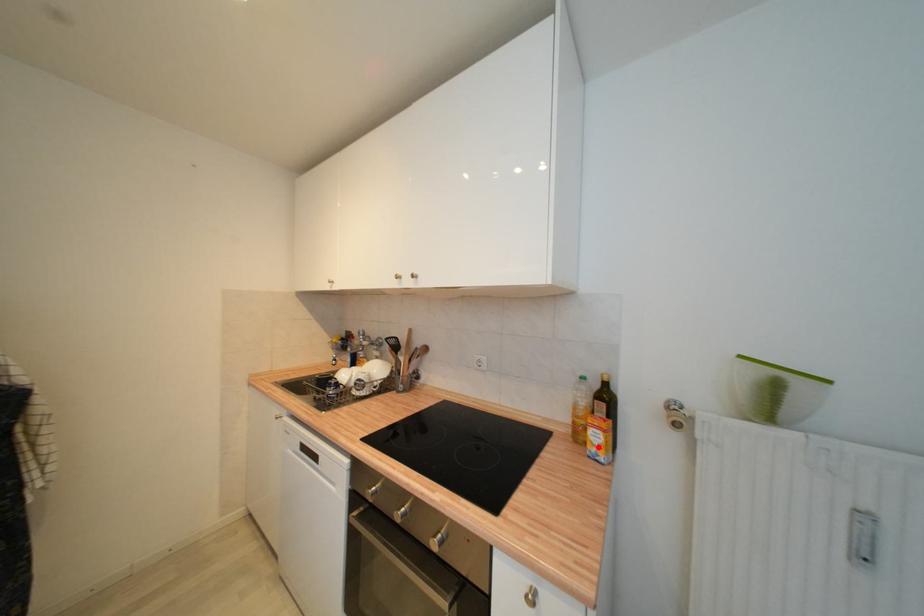
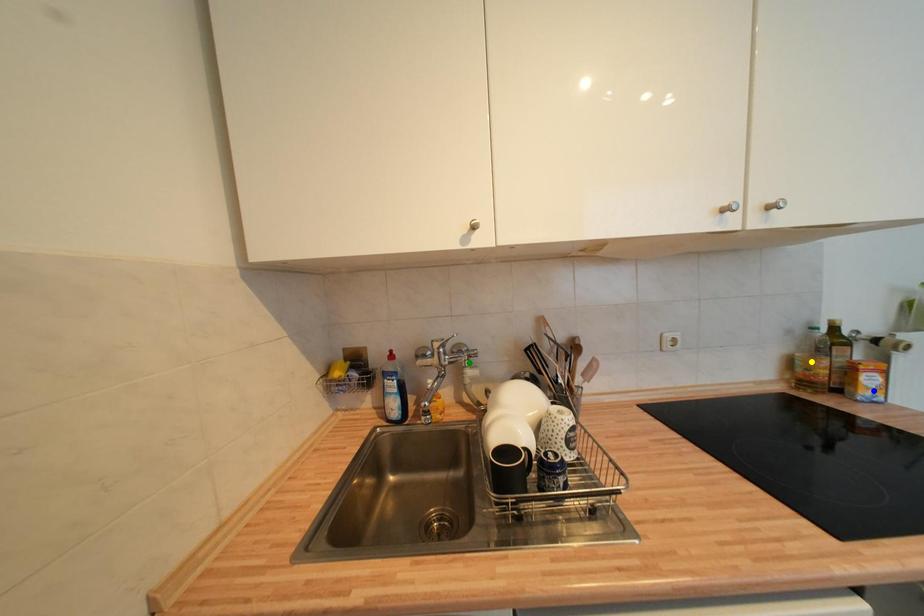
Question: I am providing you with two images of the same scene from different viewpoints. A red point is marked on the first image. You are given multiple points on the second image. Which mark in image 2 goes with the point in image 1?

Choices:
 (A) green point
 (B) blue point
 (C) yellow point

Answer: (B)